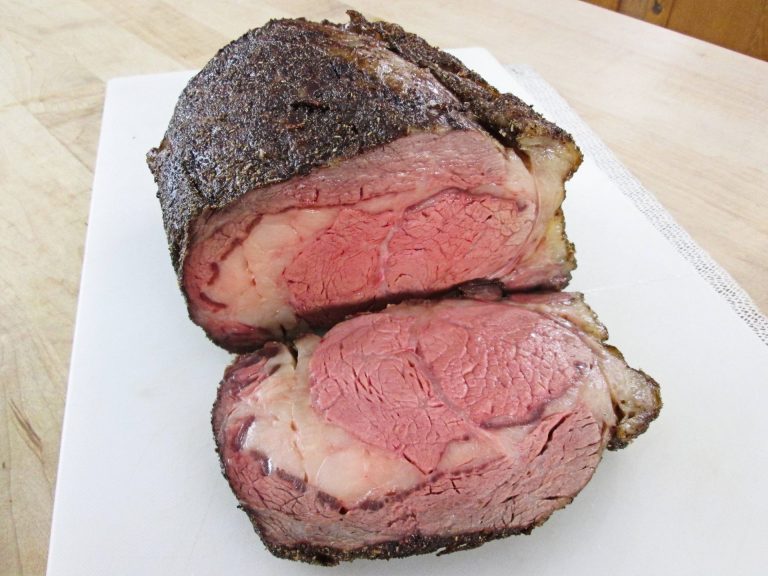
This screenshot has height=576, width=768. What are the coordinates of `lace piece under board` in the screenshot? It's located at (732, 290).